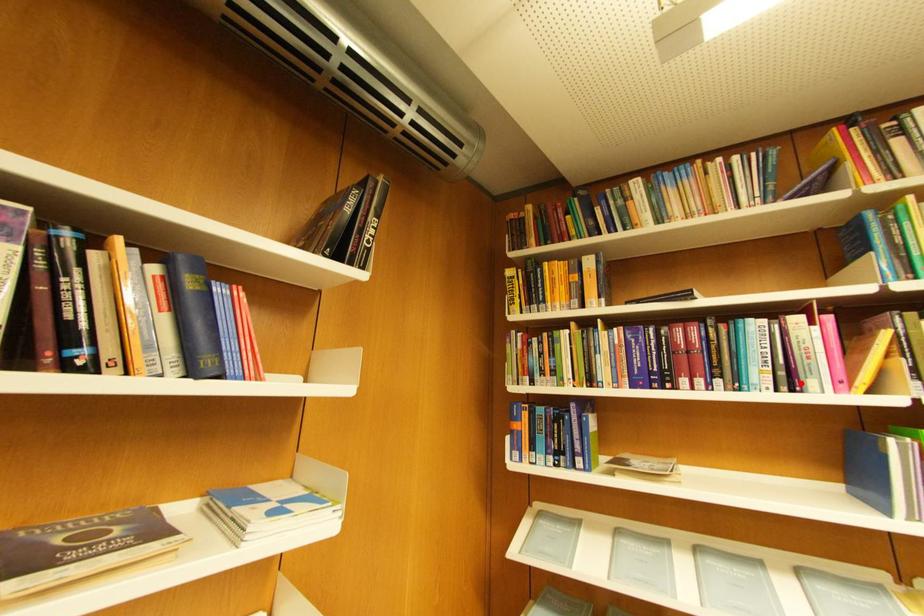
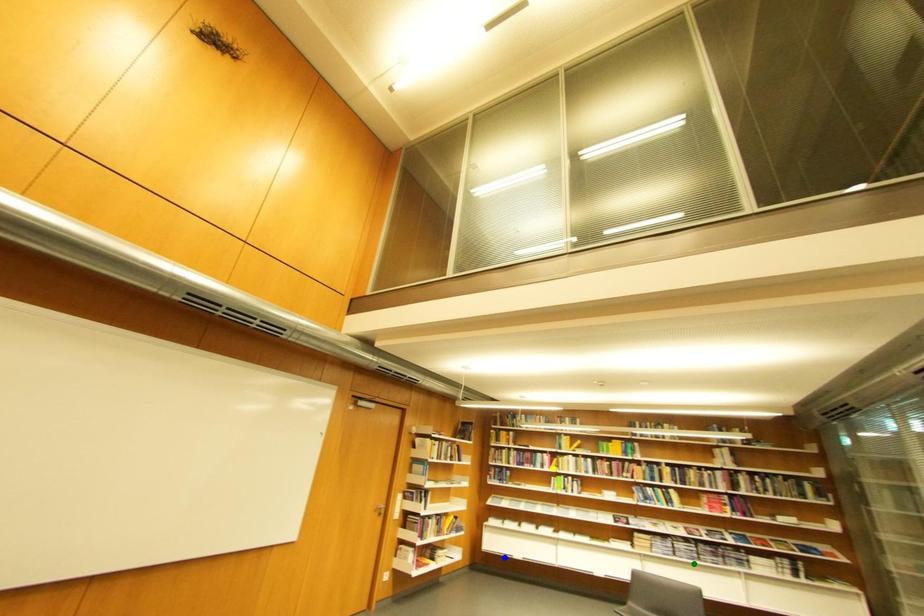
Question: I am providing you with two images of the same scene from different viewpoints. A red point is marked on the first image. You are given multiple points on the second image. Which point in image 2 represents the same 3d spot as the red point in image 1?

Choices:
 (A) blue point
 (B) yellow point
 (C) green point

Answer: (B)